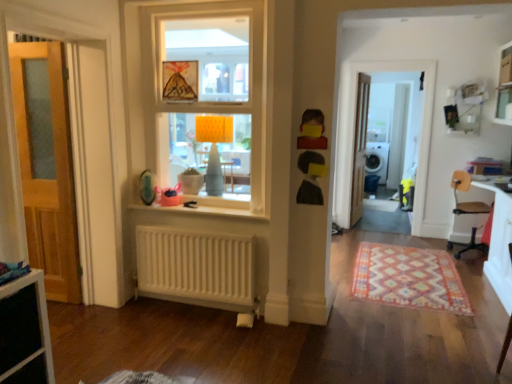
Image resolution: width=512 pixels, height=384 pixels. Find the location of `empty space that is ontop of white matte radiator at lower center`. empty space that is ontop of white matte radiator at lower center is located at coordinates (212, 228).